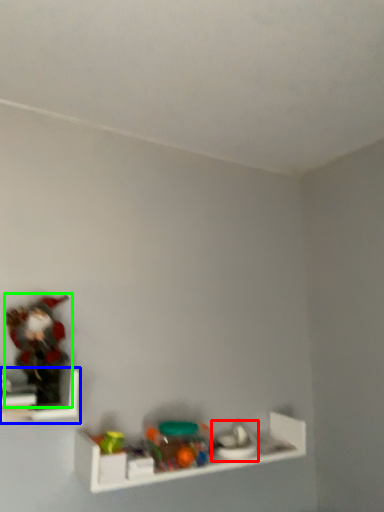
Question: Estimate the real-world distances between objects in this image. Which object is closer to toy (highlighted by a red box), shelf (highlighted by a blue box) or toy (highlighted by a green box)?

Choices:
 (A) shelf
 (B) toy

Answer: (A)